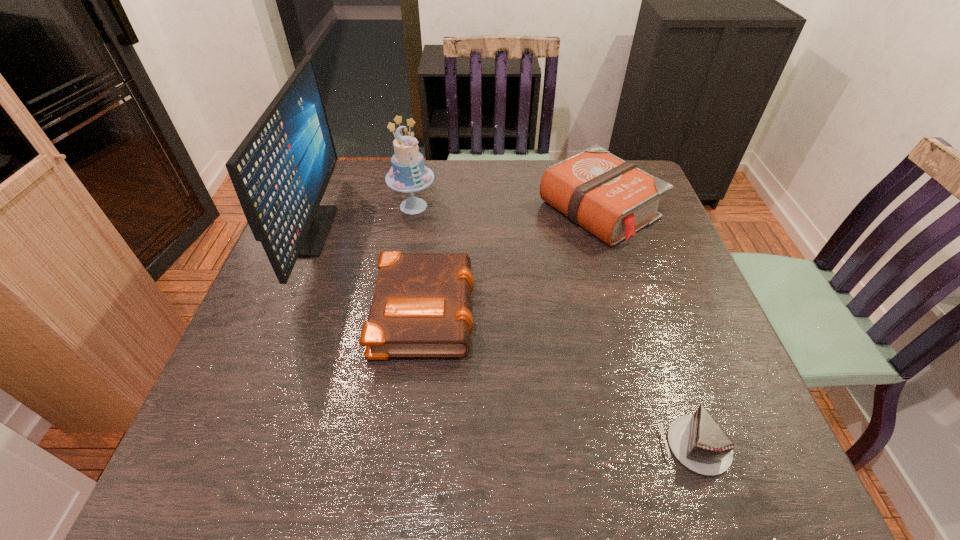
Where is `vacant area that lies between the fourth shortest object and the computer monitor`? vacant area that lies between the fourth shortest object and the computer monitor is located at coordinates (361, 219).

Where is `vacant region between the shortest object and the leftmost object`? Image resolution: width=960 pixels, height=540 pixels. vacant region between the shortest object and the leftmost object is located at coordinates (502, 339).

Locate an element on the screen. The image size is (960, 540). free space between the tallest object and the taller Bible is located at coordinates (454, 221).

The height and width of the screenshot is (540, 960). I want to click on free space between the taller Bible and the shortest object, so click(647, 328).

Identify the location of unoccupied area between the nearest object and the computer monitor. The image size is (960, 540). (502, 339).

Locate an element on the screen. free space between the cake and the third tallest object is located at coordinates (506, 208).

What are the coordinates of `blank region between the tallest object and the fourth tallest object` in the screenshot? It's located at (x=368, y=269).

Where is `free area in between the cake and the right Bible`? Image resolution: width=960 pixels, height=540 pixels. free area in between the cake and the right Bible is located at coordinates (506, 208).

The width and height of the screenshot is (960, 540). In order to click on free spot between the fourth shortest object and the shortest object in this screenshot , I will do `click(555, 326)`.

Locate an element on the screen. The height and width of the screenshot is (540, 960). free area in between the shorter Bible and the farther Bible is located at coordinates (512, 259).